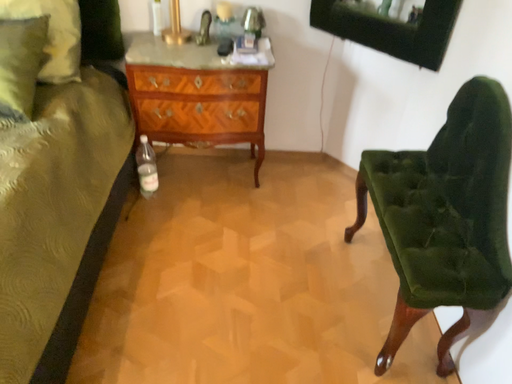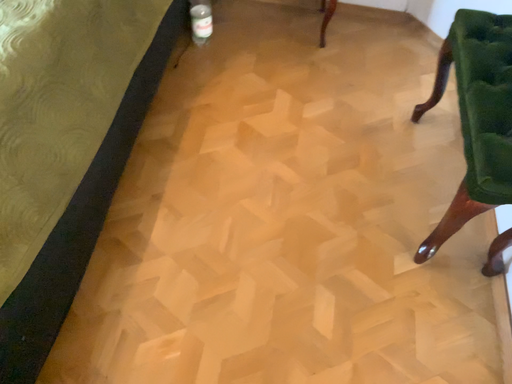
Question: Which way did the camera rotate in the video?

Choices:
 (A) rotated right
 (B) rotated left

Answer: (B)